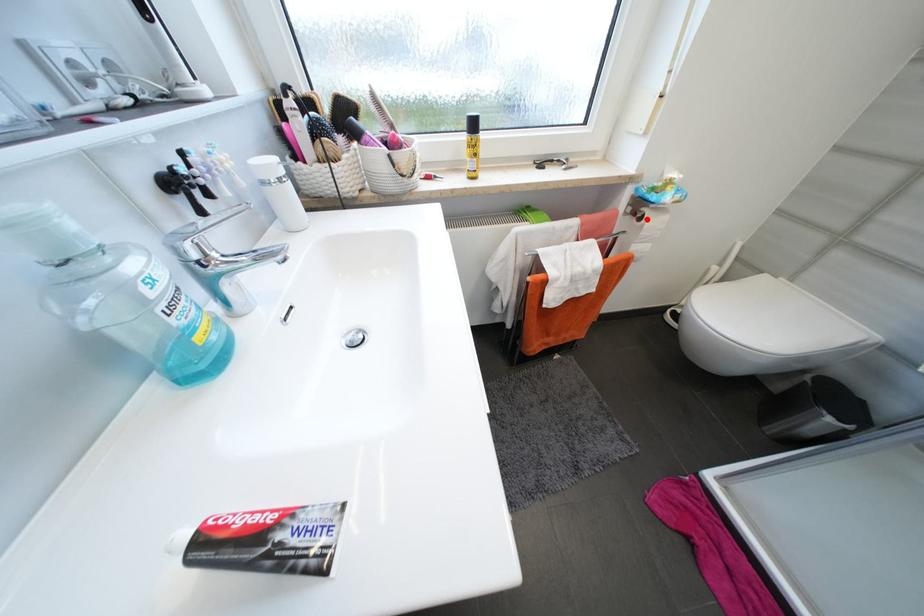
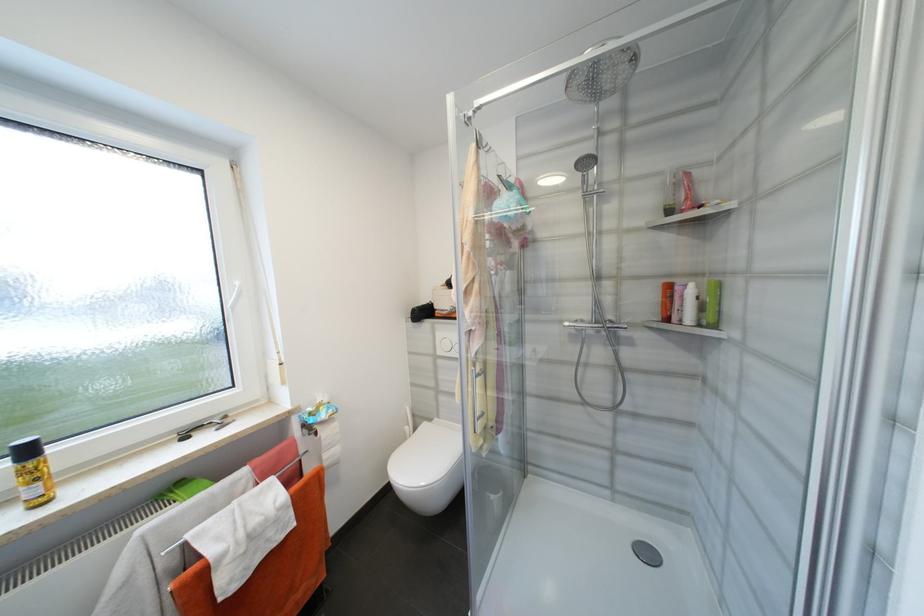
Where in the second image is the point corresponding to the highlighted location from the first image?

(322, 435)